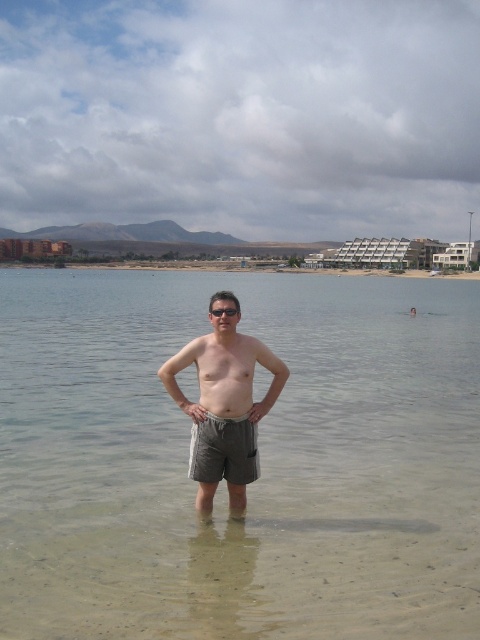
Question: Does gray fabric shorts at center have a larger size compared to khaki shorts at center?

Choices:
 (A) yes
 (B) no

Answer: (A)

Question: Which of the following is the farthest from the observer?

Choices:
 (A) gray fabric shorts at center
 (B) transparent plastic goggles at center
 (C) gray cotton shorts at center
 (D) khaki shorts at center

Answer: (C)

Question: Which point is farther from the camera taking this photo?

Choices:
 (A) (214, 420)
 (B) (205, 358)
 (C) (25, 531)
 (D) (219, 312)

Answer: (C)

Question: Is gray fabric shorts at center to the left of transparent plastic goggles at center from the viewer's perspective?

Choices:
 (A) no
 (B) yes

Answer: (B)

Question: Which point appears closest to the camera in this image?

Choices:
 (A) (252, 477)
 (B) (215, 316)

Answer: (B)

Question: Is khaki shorts at center behind gray cotton shorts at center?

Choices:
 (A) no
 (B) yes

Answer: (A)